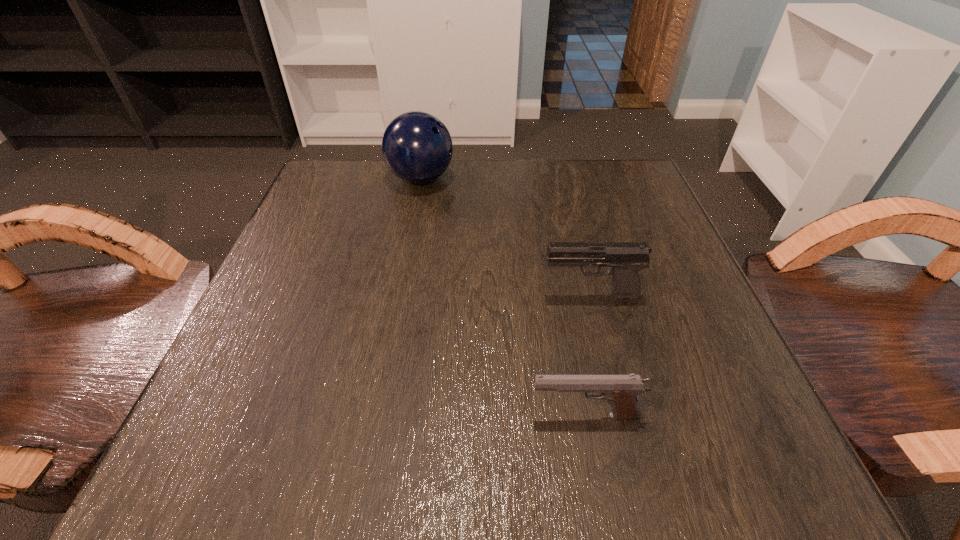
I want to click on the farthest object, so click(417, 147).

Where is `the leftmost object`? Image resolution: width=960 pixels, height=540 pixels. the leftmost object is located at coordinates (417, 147).

Where is `the farther pistol`? the farther pistol is located at coordinates (626, 259).

This screenshot has width=960, height=540. I want to click on the second farthest object, so click(626, 259).

What are the coordinates of `the shorter pistol` in the screenshot? It's located at (621, 391).

Find the location of a particular element. The width and height of the screenshot is (960, 540). the nearer pistol is located at coordinates (621, 391).

Find the location of `vacant space located on the surface of the farthest object near the finger holes`. vacant space located on the surface of the farthest object near the finger holes is located at coordinates (551, 179).

Find the location of a particular element. vacant region located 0.230m aim along the barrel of the second shortest object is located at coordinates (403, 298).

Locate an element on the screen. vacant region located 0.190m aim along the barrel of the second shortest object is located at coordinates (427, 298).

Image resolution: width=960 pixels, height=540 pixels. I want to click on vacant area located 0.130m aim along the barrel of the second shortest object, so click(464, 298).